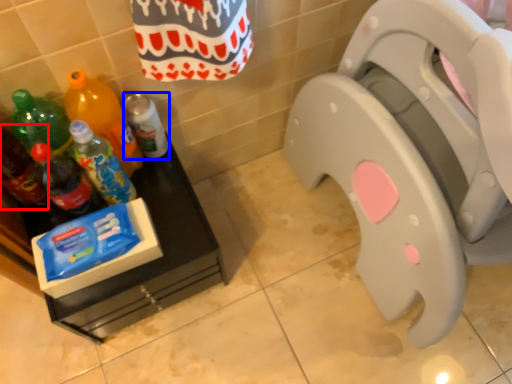
Question: Which object is further to the camera taking this photo, bottle (highlighted by a red box) or bottle (highlighted by a blue box)?

Choices:
 (A) bottle
 (B) bottle

Answer: (B)